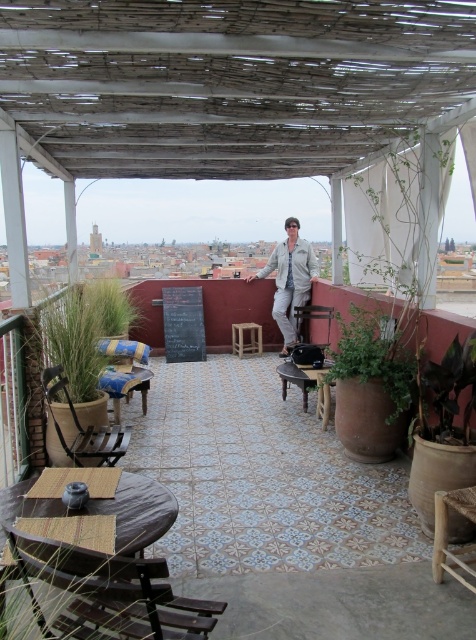
Question: Is wooden chair at left to the left of matte black chair at center from the viewer's perspective?

Choices:
 (A) no
 (B) yes

Answer: (B)

Question: Which of the following is the farthest from the observer?

Choices:
 (A) (48, 397)
 (B) (239, 348)
 (C) (470, 339)

Answer: (B)

Question: Which object appears closest to the camera in this image?

Choices:
 (A) matte black chair at center
 (B) green leafy plant at upper right
 (C) light gray fabric jacket at center

Answer: (B)

Question: Can you confirm if wooden woven chair at lower left is positioned to the left of blue fabric chair at left?

Choices:
 (A) no
 (B) yes

Answer: (A)

Question: Estimate the real-world distances between objects in this image. Which object is farther from the green glossy leafy plant at center-right?

Choices:
 (A) light gray fabric jacket at center
 (B) green leafy plant at upper right

Answer: (A)

Question: Where is green glossy leafy plant at center-right located in relation to woven wood chair at lower right in the image?

Choices:
 (A) below
 (B) above

Answer: (B)